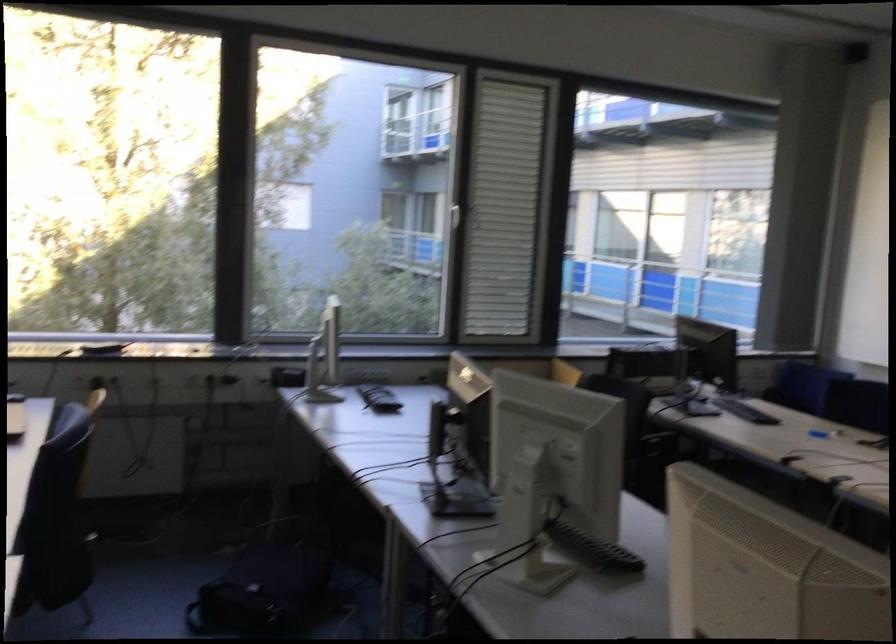
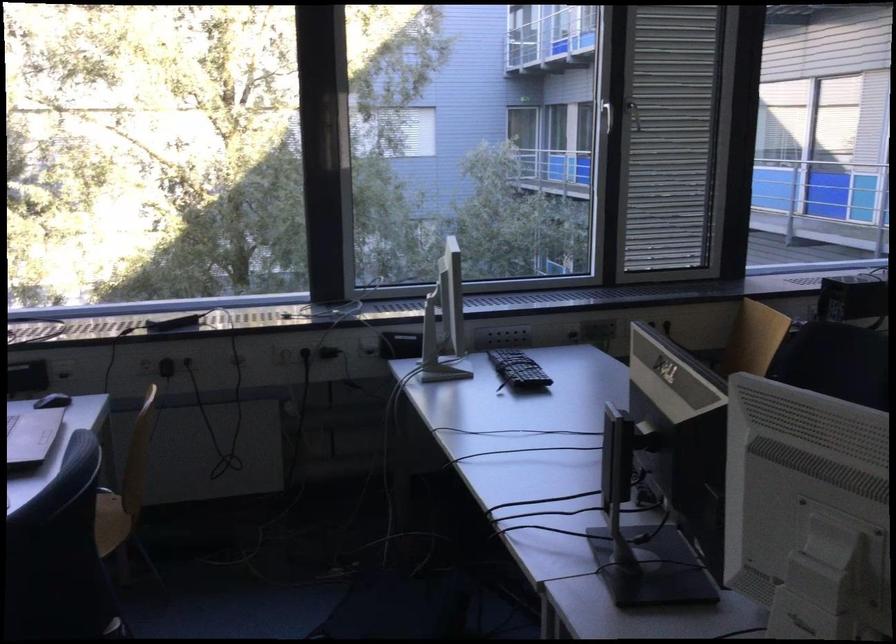
Locate, in the second image, the point that corresponds to the point at 259,372 in the first image.

(367, 348)